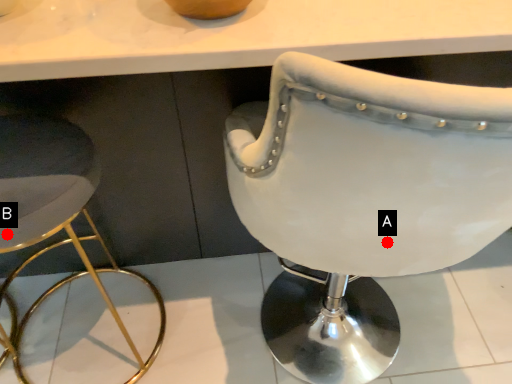
Question: Two points are circled on the image, labeled by A and B beside each circle. Which point appears closest to the camera in this image?

Choices:
 (A) A is closer
 (B) B is closer

Answer: (A)